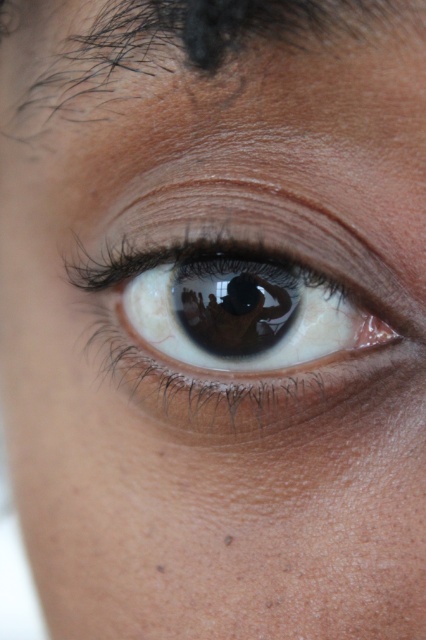
Is brown glossy eye at center smaller than dark brown hair at upper center?

Indeed, brown glossy eye at center has a smaller size compared to dark brown hair at upper center.

Looking at this image, is brown glossy eye at center taller than dark brown hair at upper center?

Indeed, brown glossy eye at center has a greater height compared to dark brown hair at upper center.

Is point (160, 220) more distant than point (146, 28)?

Yes, it is.

Find the location of `brown glossy eye at center`. brown glossy eye at center is located at coordinates (244, 310).